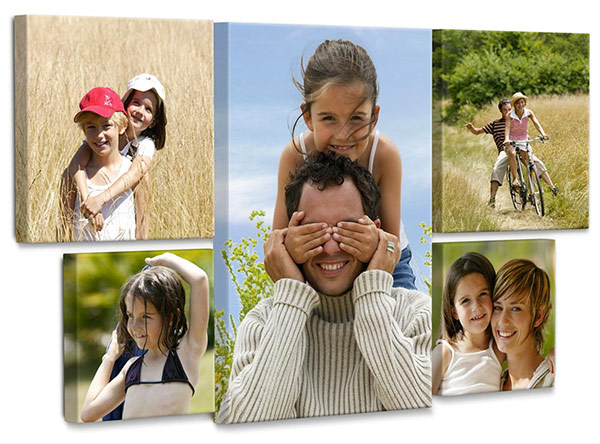
At what (x,y) coordinates should I click in order to perform the action: click on picture printed on canvas. Please return your answer as a coordinate pair (x, y). The width and height of the screenshot is (600, 444). Looking at the image, I should click on (505, 334), (519, 143), (330, 195), (180, 164), (147, 326).